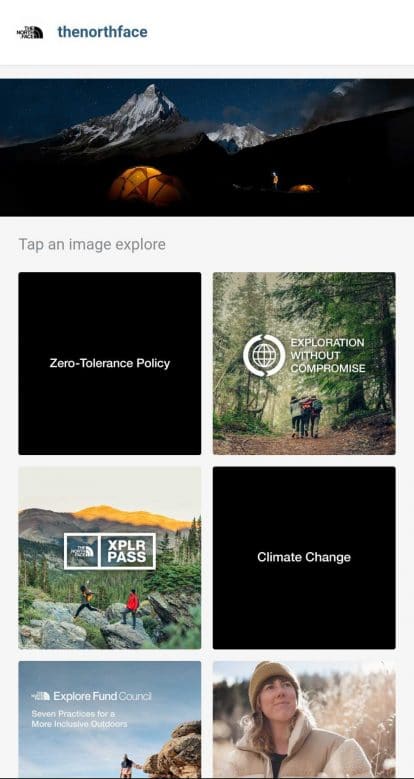
Image resolution: width=414 pixels, height=779 pixels. I want to click on square shaped photograph, so click(x=275, y=735), click(x=135, y=738), click(x=129, y=617), click(x=329, y=365).